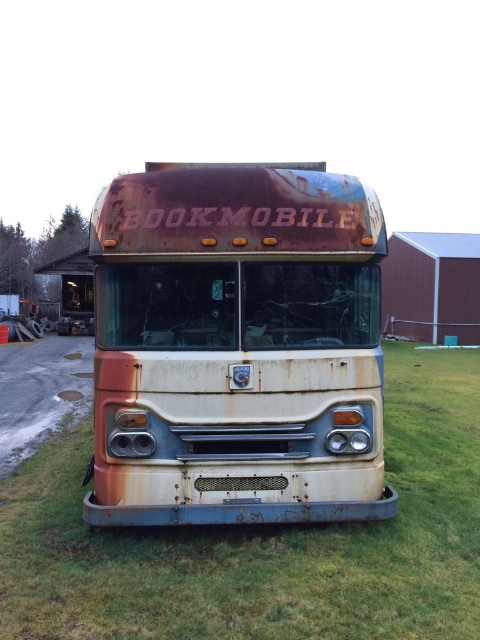
You are standing in front of the rusted bus and notice two points marked on its surface. The first point is at coordinates point [297,390] and the second is at point [386,420]. Which of these points is nearer to your current position?

Point [297,390] is closer to the camera than point [386,420], so the first point is nearer to your current position.

You are a maintenance worker inspecting the front of the rusty metal bookmobile at center and the rusty metal bus at center. Which one is positioned more to the left side?

The rusty metal bookmobile at center is positioned more to the left side than the rusty metal bus at center.

You are a delivery person trying to park your van next to the rusty metal bookmobile at center and the rusty metal bus at center. Which one has a narrower width to allow more space for your van?

The rusty metal bookmobile at center has a narrower width than the rusty metal bus at center, so parking next to it would leave more space for your van.